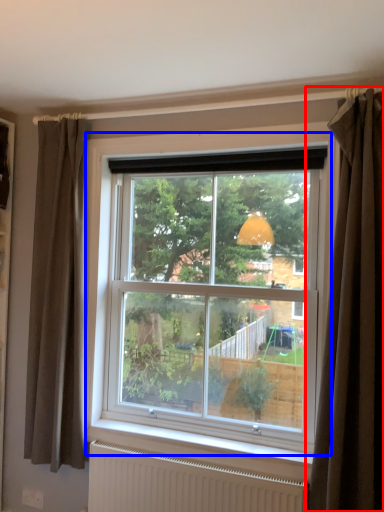
Question: Which object is further to the camera taking this photo, curtain (highlighted by a red box) or window (highlighted by a blue box)?

Choices:
 (A) curtain
 (B) window

Answer: (B)